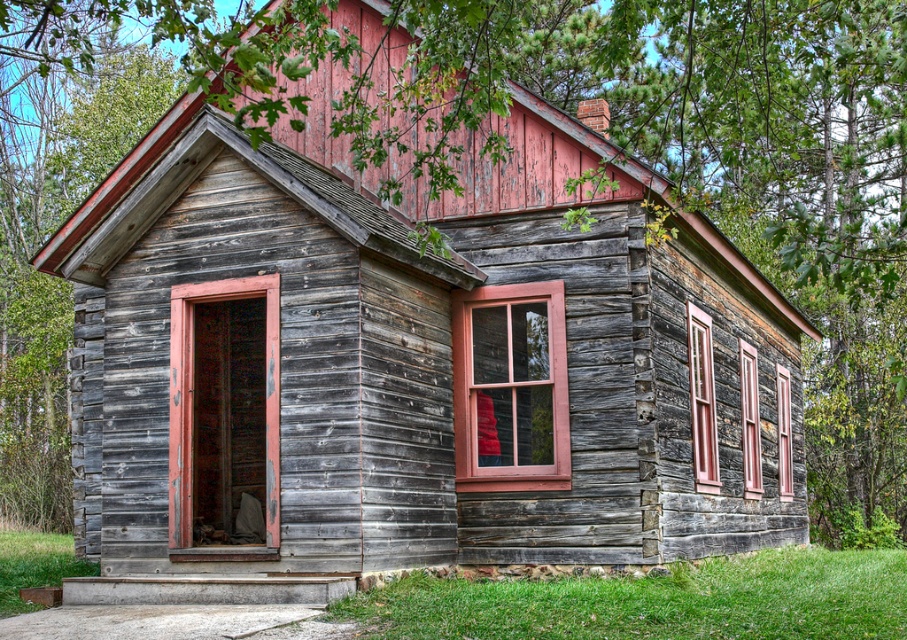
You are a delivery person trying to enter the cabin. You have a large package that is 1 meter wide. The wooden door at center and the clear glass window at right are the only entry points. Can you fit the package through either of them?

The wooden door at center is wider than the clear glass window at right. Since the package is 1 meter wide, you should check the door first. If the door is wide enough, you can fit the package through it. However, without knowing the exact width of the door, it is impossible to determine for certain.

You are standing in front of the rustic wooden cabin and want to determine which window is narrower. You see the wooden window at center right and the clear glass window at right. Which one is narrower?

The wooden window at center right is thinner than the clear glass window at right, so the wooden window at center right is narrower.

You are standing in front of the rustic wooden cabin and notice two windows. The first is the matte wooden window at center, and the second is the wooden window at right. Which window is located more to the left?

The matte wooden window at center is positioned more to the left than the wooden window at right.